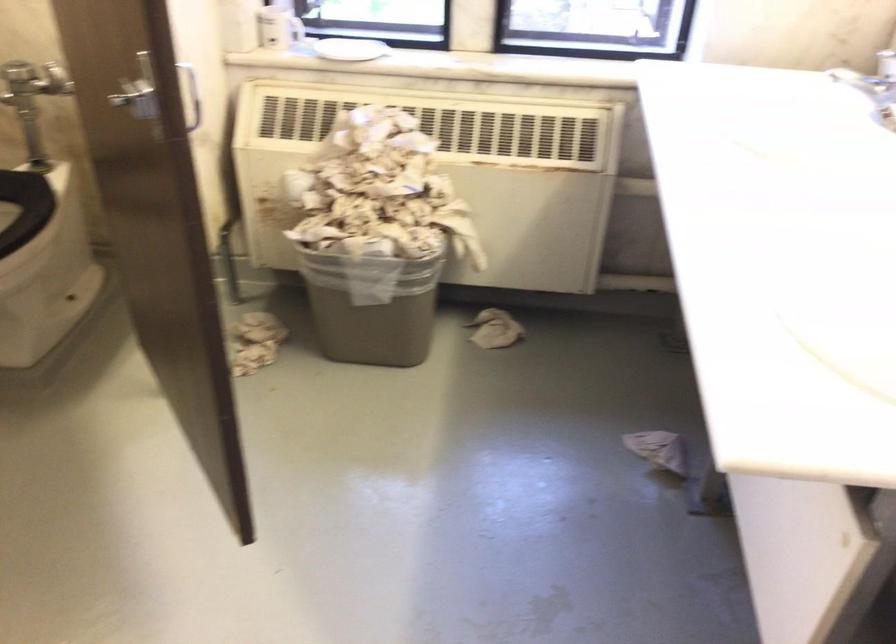
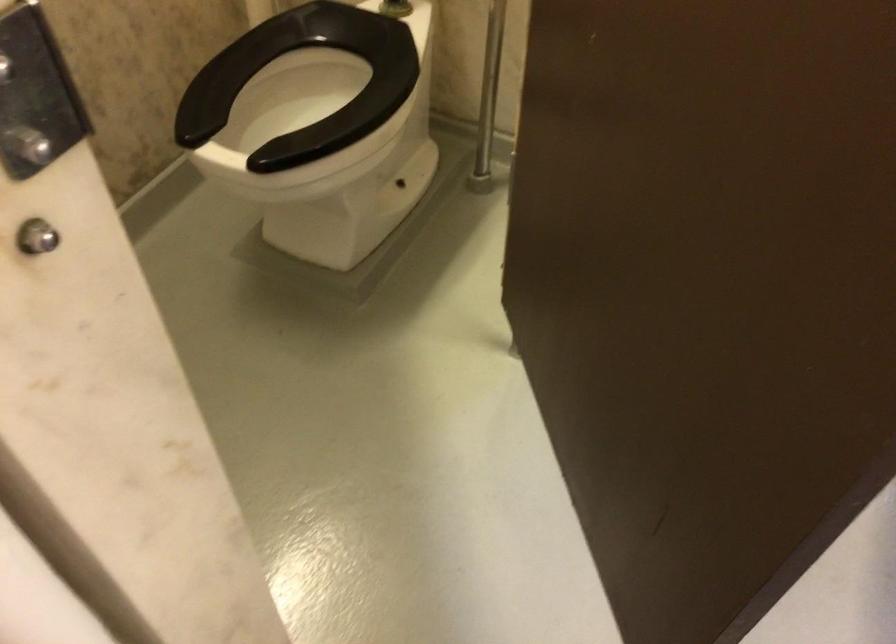
In a continuous first-person perspective shot, in which direction is the camera moving?

The movement direction of the cameraman is left, forward.